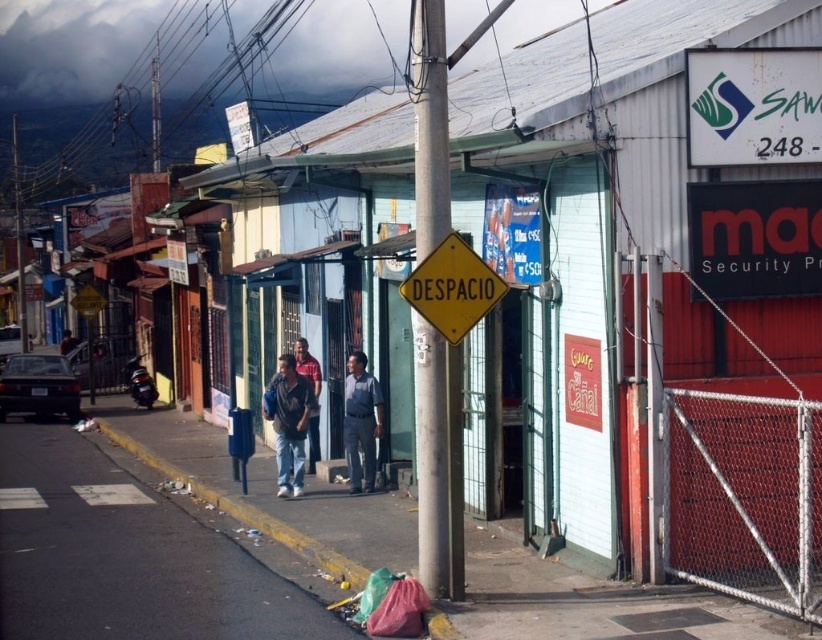
Question: Considering the real-world distances, which object is farthest from the blue jeans at center?

Choices:
 (A) white plastic sign at upper right
 (B) denim jacket at center

Answer: (A)

Question: Does gray asphalt pavement at lower center appear under denim jacket at center?

Choices:
 (A) no
 (B) yes

Answer: (B)

Question: Estimate the real-world distances between objects in this image. Which object is closer to the yellow matte sign at center?

Choices:
 (A) dark blue uniform at center
 (B) blue jeans at center
 (C) metallic pole at center

Answer: (C)

Question: Which object is closer to the camera taking this photo?

Choices:
 (A) yellow matte sign at center
 (B) denim jacket at center
 (C) white plastic sign at upper right
 (D) dark blue uniform at center

Answer: (A)

Question: Can you confirm if metallic pole at center is positioned to the right of denim jacket at center?

Choices:
 (A) no
 (B) yes

Answer: (B)

Question: Does denim jacket at center appear on the left side of dark blue jeans at center?

Choices:
 (A) yes
 (B) no

Answer: (A)